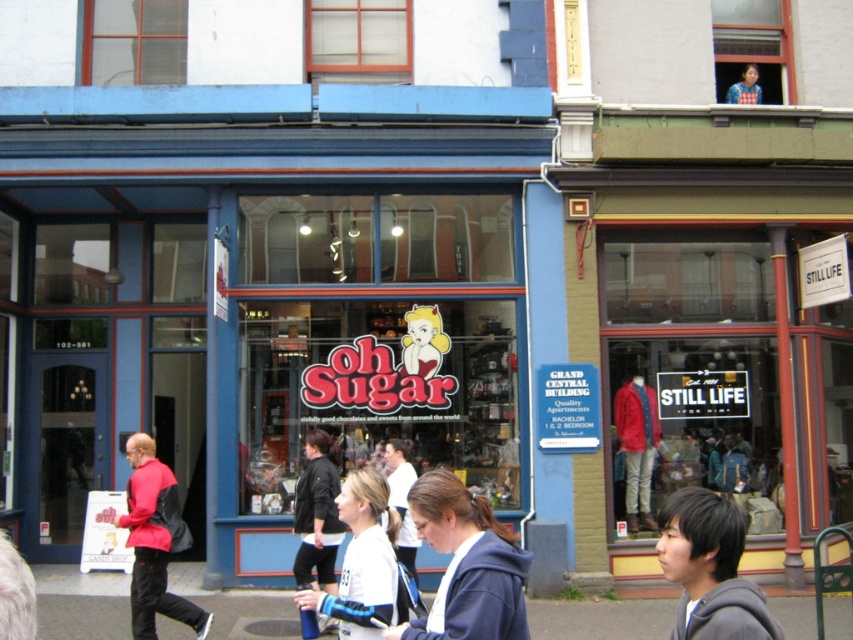
Question: Is gray fleece jacket at lower right in front of red cotton jacket at center?

Choices:
 (A) no
 (B) yes

Answer: (B)

Question: Which object is positioned farthest from the dark blue hoodie at center?

Choices:
 (A) black leather jacket at lower center
 (B) white matte jacket at center
 (C) matte blue storefront at center

Answer: (C)

Question: Estimate the real-world distances between objects in this image. Which object is farther from the white matte jacket at center?

Choices:
 (A) red matte jacket at lower left
 (B) white fur at lower left
 (C) blue fabric shirt at upper right
 (D) gray fleece jacket at lower right

Answer: (C)

Question: Does gray fleece jacket at lower right appear on the left side of blue fabric shirt at upper right?

Choices:
 (A) yes
 (B) no

Answer: (A)

Question: Estimate the real-world distances between objects in this image. Which object is farther from the red matte jacket at lower left?

Choices:
 (A) gray fleece jacket at lower right
 (B) dark blue hoodie at center
 (C) white fur at lower left
 (D) red cotton jacket at center

Answer: (D)

Question: Can you confirm if gray fleece jacket at lower right is thinner than white fur at lower left?

Choices:
 (A) yes
 (B) no

Answer: (B)